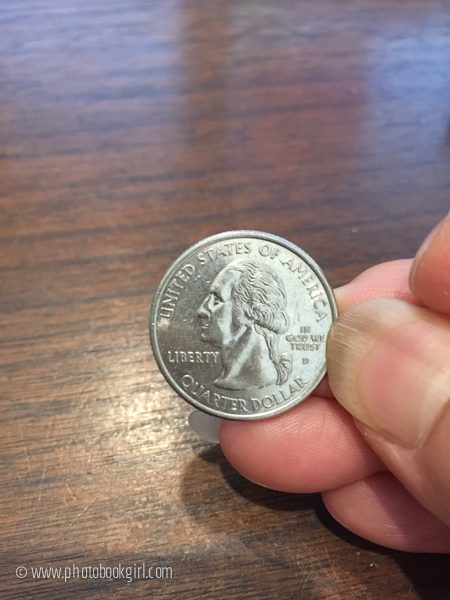
Find the location of a particular element. The height and width of the screenshot is (600, 450). table is located at coordinates (80, 355).